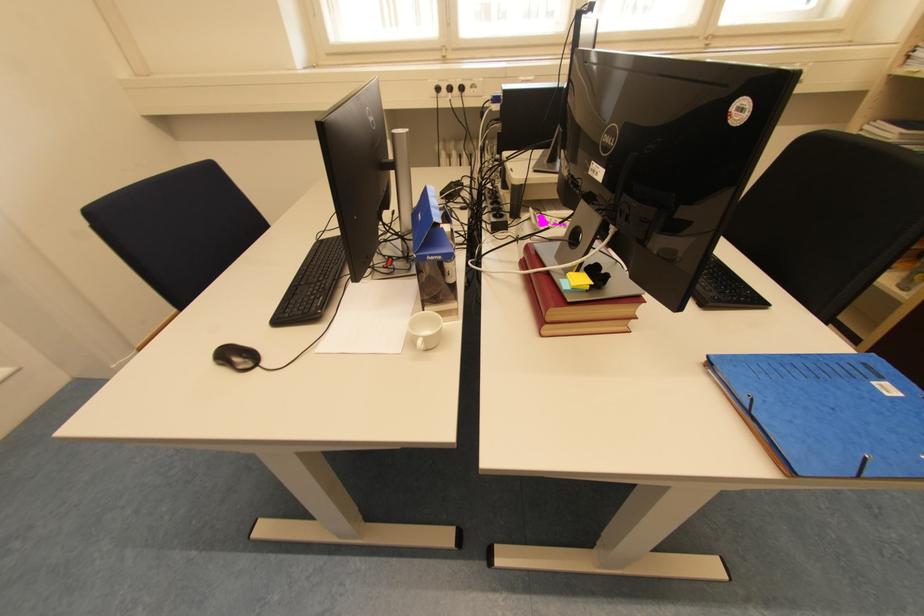
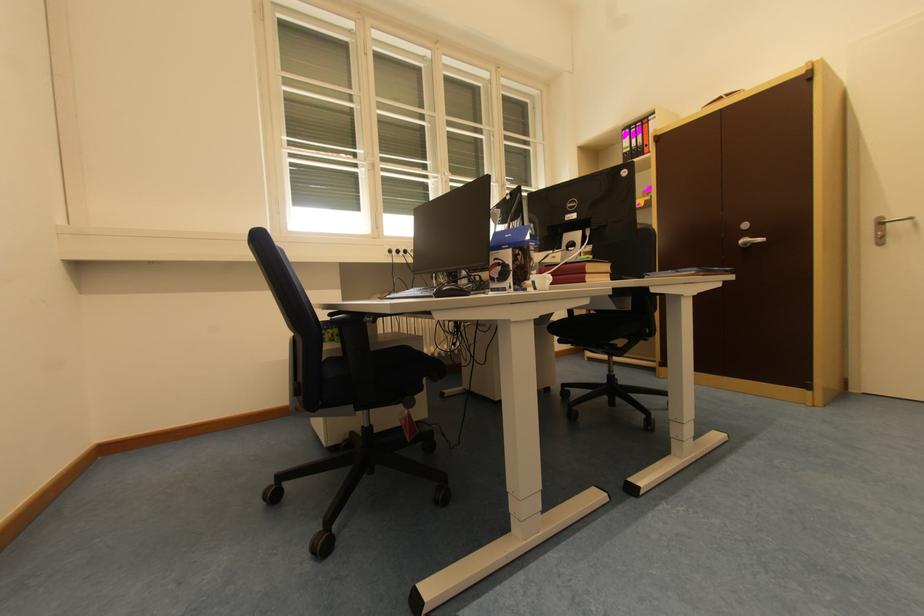
Find the pixel in the second image that matches point 555,321 in the first image.

(593, 273)